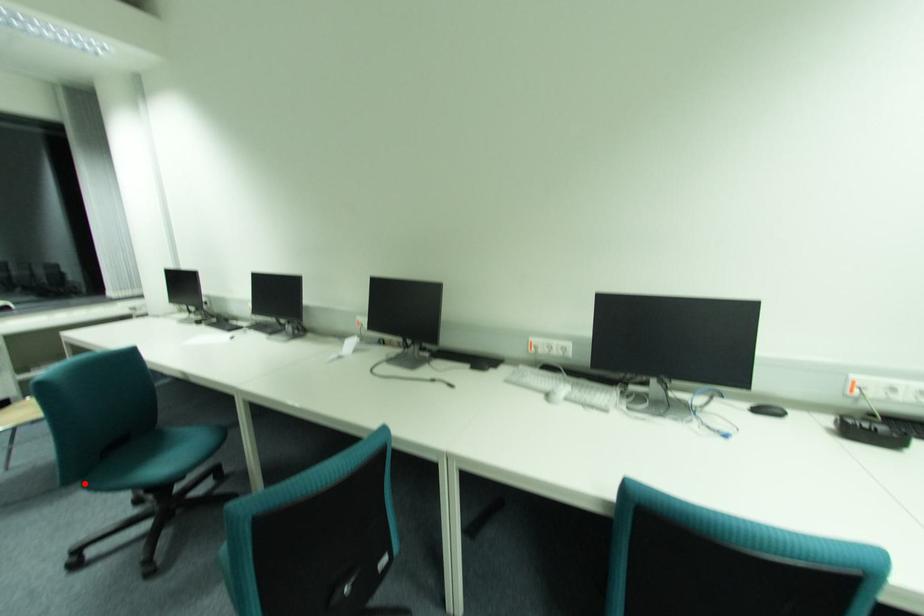
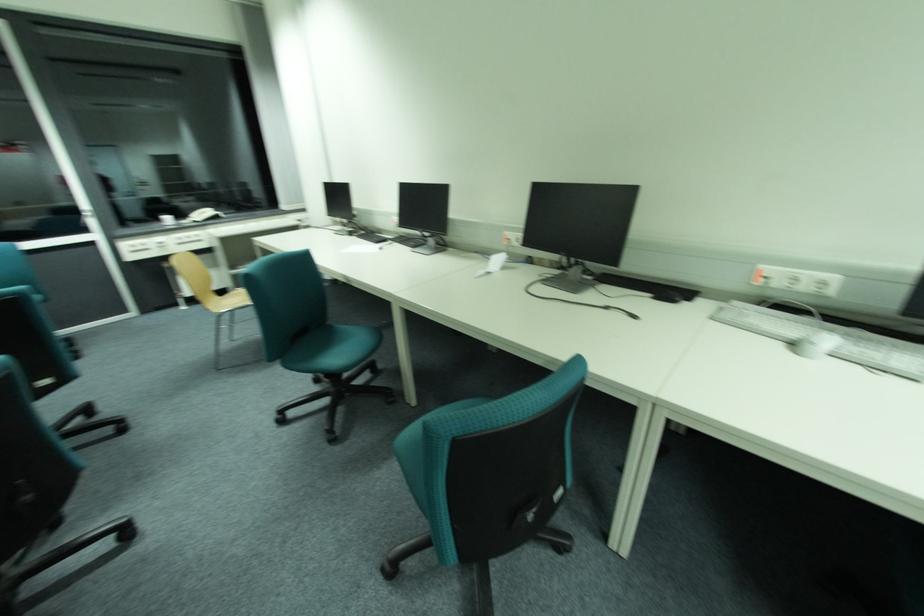
Find the pixel in the second image that matches the highlighted location in the first image.

(285, 361)